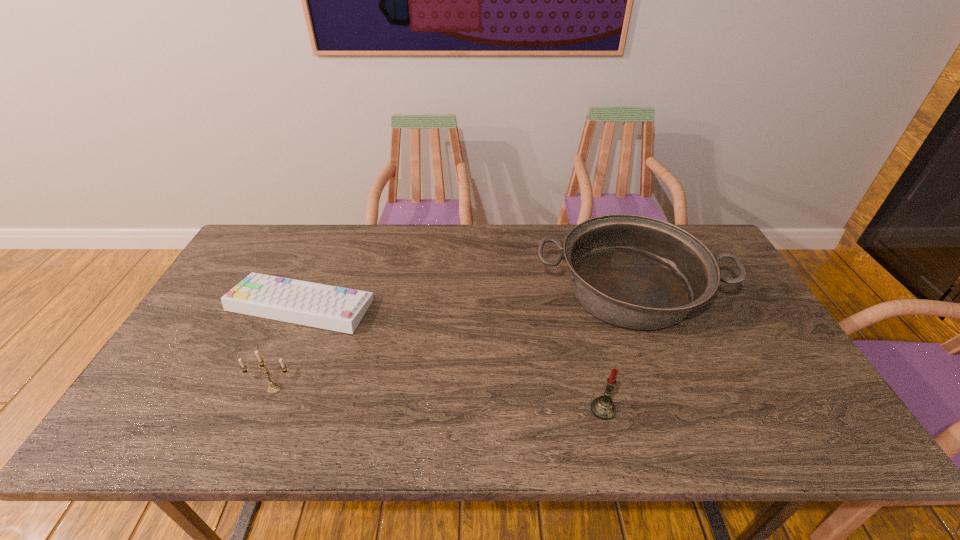
Find the location of a particular element. The image size is (960, 540). vacant area at the near left corner is located at coordinates (128, 446).

The height and width of the screenshot is (540, 960). In the image, there is a desktop. Identify the location of vacant space at the far right corner. (724, 264).

Identify the location of free area in between the farther candle and the pan. (451, 339).

In order to click on unoccupied position between the nearest object and the farther candle in this screenshot , I will do `click(439, 399)`.

At what (x,y) coordinates should I click in order to perform the action: click on free space between the second nearest object and the pan. Please return your answer as a coordinate pair (x, y). Looking at the image, I should click on (451, 339).

Image resolution: width=960 pixels, height=540 pixels. I want to click on vacant space that is in between the pan and the computer keyboard, so click(465, 298).

This screenshot has height=540, width=960. What are the coordinates of `blank region between the pan and the computer keyboard` in the screenshot? It's located at (465, 298).

Locate an element on the screen. The width and height of the screenshot is (960, 540). free space between the pan and the nearest object is located at coordinates (615, 349).

Find the location of a particular element. free space between the pan and the farther candle is located at coordinates (451, 339).

Locate an element on the screen. This screenshot has height=540, width=960. blank region between the pan and the computer keyboard is located at coordinates (465, 298).